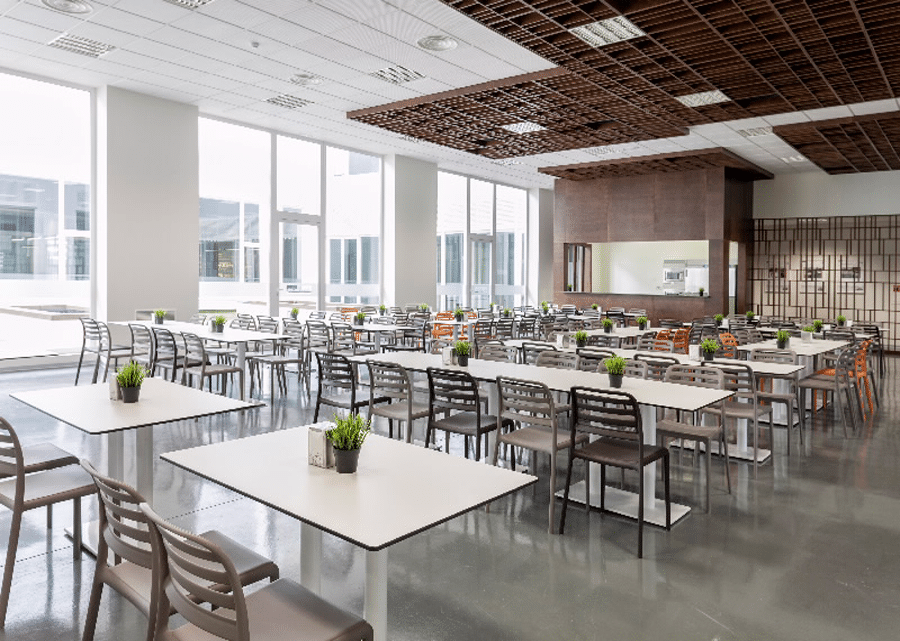
Where is `napkin dispensers`? The height and width of the screenshot is (641, 900). napkin dispensers is located at coordinates (313, 456), (110, 377), (148, 311), (211, 328), (445, 358), (695, 352), (563, 333), (354, 326), (289, 312), (598, 309).